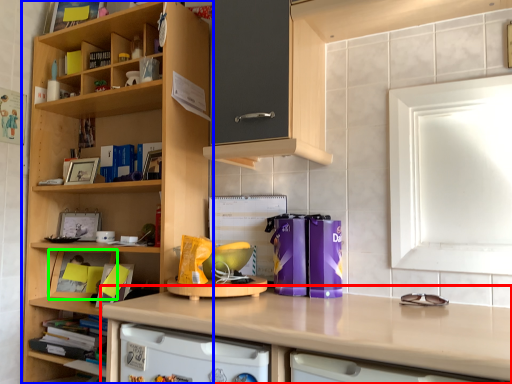
Question: Which object is positioned farthest from countertop (highlighted by a red box)? Select from cupboard (highlighted by a blue box) and cabinet (highlighted by a green box).

Choices:
 (A) cupboard
 (B) cabinet

Answer: (B)